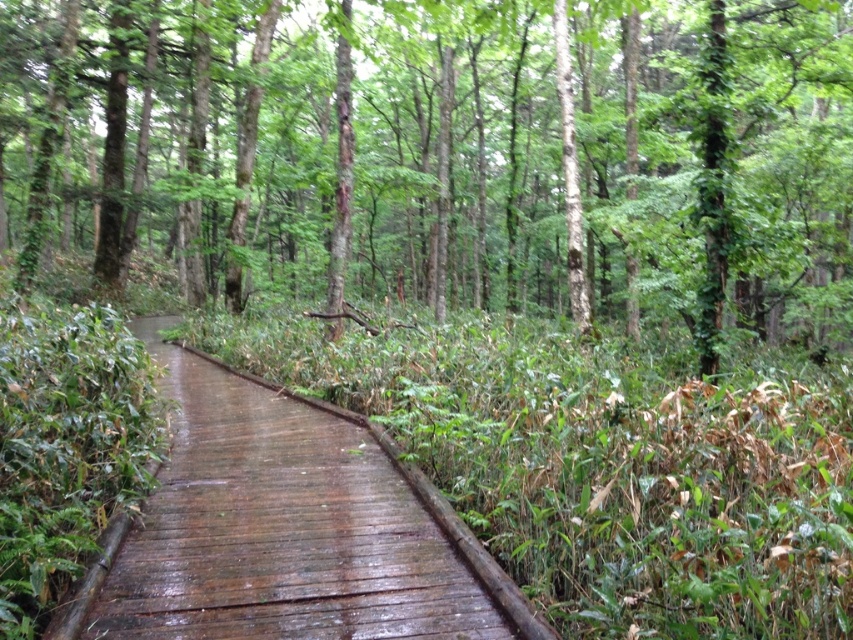
Question: Where is green matte tree at center located in relation to wet wooden boardwalk at center in the image?

Choices:
 (A) left
 (B) right

Answer: (A)

Question: Can you confirm if green matte tree at center is wider than wet wooden boardwalk at center?

Choices:
 (A) no
 (B) yes

Answer: (B)

Question: Does green matte tree at center have a smaller size compared to wet wooden boardwalk at center?

Choices:
 (A) yes
 (B) no

Answer: (B)

Question: Which point is farther to the camera?

Choices:
 (A) (686, 216)
 (B) (439, 541)

Answer: (A)

Question: Which point is farther to the camera?

Choices:
 (A) (166, 554)
 (B) (505, 289)

Answer: (B)